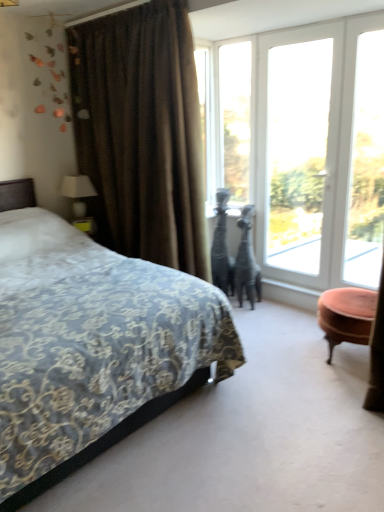
Question: From the image's perspective, is transparent glass window at upper center, which is counted as the fourth window, starting from the right, over velvet-patterned bed at left?

Choices:
 (A) yes
 (B) no

Answer: (A)

Question: Is there a large distance between transparent glass window at upper center, which is counted as the fourth window, starting from the right, and velvet-patterned bed at left?

Choices:
 (A) no
 (B) yes

Answer: (B)

Question: From the image's perspective, is transparent glass window at upper center, the first window when ordered from left to right, located beneath velvet-patterned bed at left?

Choices:
 (A) no
 (B) yes

Answer: (A)

Question: Considering the relative positions of transparent glass window at upper center, the first window when ordered from left to right, and velvet-patterned bed at left in the image provided, is transparent glass window at upper center, the first window when ordered from left to right, to the left of velvet-patterned bed at left from the viewer's perspective?

Choices:
 (A) no
 (B) yes

Answer: (A)

Question: Can you confirm if transparent glass window at upper center, the first window when ordered from left to right, is shorter than velvet-patterned bed at left?

Choices:
 (A) no
 (B) yes

Answer: (A)

Question: Does point (349, 309) appear closer or farther from the camera than point (218, 68)?

Choices:
 (A) closer
 (B) farther

Answer: (A)

Question: Considering the relative positions of velvet pink ottoman at right and clear glass window at center, the 2th window positioned from the left, in the image provided, is velvet pink ottoman at right to the left or to the right of clear glass window at center, the 2th window positioned from the left,?

Choices:
 (A) right
 (B) left

Answer: (A)

Question: Is velvet pink ottoman at right inside the boundaries of clear glass window at center, the 3th window positioned from the right, or outside?

Choices:
 (A) inside
 (B) outside

Answer: (B)

Question: From a real-world perspective, is velvet pink ottoman at right positioned above or below clear glass window at center, the 2th window positioned from the left?

Choices:
 (A) below
 (B) above

Answer: (A)

Question: Considering the positions of clear glass window at center, the 2th window positioned from the left, and velvet pink ottoman at right in the image, is clear glass window at center, the 2th window positioned from the left, bigger or smaller than velvet pink ottoman at right?

Choices:
 (A) small
 (B) big

Answer: (A)

Question: From the image's perspective, is clear glass window at center, the 3th window positioned from the right, positioned above or below velvet pink ottoman at right?

Choices:
 (A) below
 (B) above

Answer: (B)

Question: From a real-world perspective, relative to velvet pink ottoman at right, is clear glass window at center, the 2th window positioned from the left, vertically above or below?

Choices:
 (A) below
 (B) above

Answer: (B)

Question: Looking at their shapes, would you say clear glass window at center, the 2th window positioned from the left, is wider or thinner than velvet pink ottoman at right?

Choices:
 (A) thin
 (B) wide

Answer: (A)

Question: Looking at their shapes, would you say velvet-patterned bed at left is wider or thinner than white fabric lampshade at left?

Choices:
 (A) thin
 (B) wide

Answer: (B)

Question: Considering the positions of velvet-patterned bed at left and white fabric lampshade at left in the image, is velvet-patterned bed at left bigger or smaller than white fabric lampshade at left?

Choices:
 (A) small
 (B) big

Answer: (B)